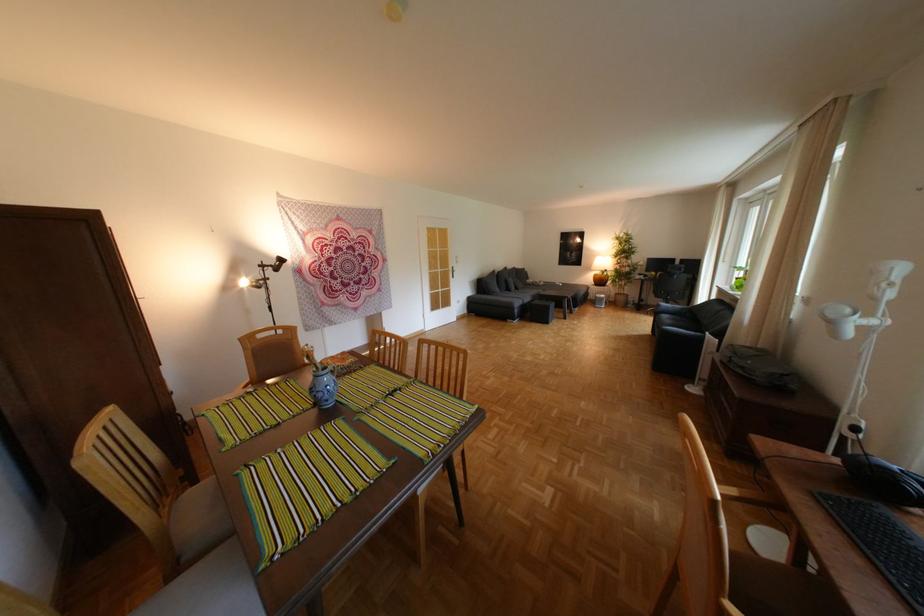
Locate an element on the screen. This screenshot has height=616, width=924. white lamp head is located at coordinates (867, 301).